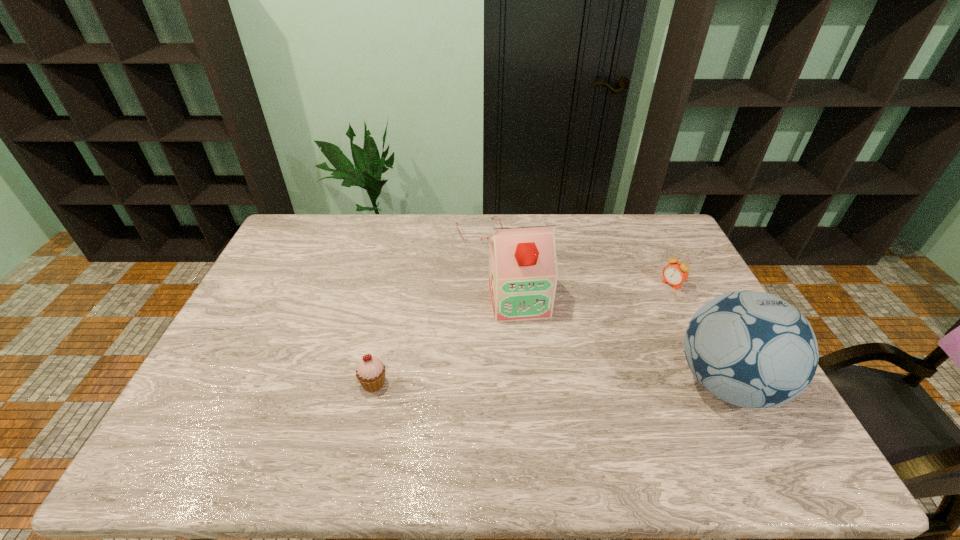
The width and height of the screenshot is (960, 540). In order to click on cupcake in this screenshot , I will do `click(370, 372)`.

This screenshot has width=960, height=540. What are the coordinates of `soccer ball` in the screenshot? It's located at (752, 349).

Locate an element on the screen. Image resolution: width=960 pixels, height=540 pixels. soya milk is located at coordinates (523, 273).

Identify the location of alarm clock. This screenshot has width=960, height=540. (675, 273).

Where is `the farthest object`? This screenshot has height=540, width=960. the farthest object is located at coordinates (473, 240).

Find the location of a particular element. The width and height of the screenshot is (960, 540). spectacles is located at coordinates (473, 240).

I want to click on vacant space situated on the right of the cupcake, so click(x=492, y=383).

At what (x,y) coordinates should I click in order to perform the action: click on vacant region located 0.230m with the cap open on the soya milk. Please return your answer as a coordinate pair (x, y). The height and width of the screenshot is (540, 960). Looking at the image, I should click on (540, 387).

The height and width of the screenshot is (540, 960). In order to click on vacant region located 0.150m with the cap open on the soya milk in this screenshot , I will do `click(534, 362)`.

What are the coordinates of `free space located with the cap open on the soya milk` in the screenshot? It's located at (529, 343).